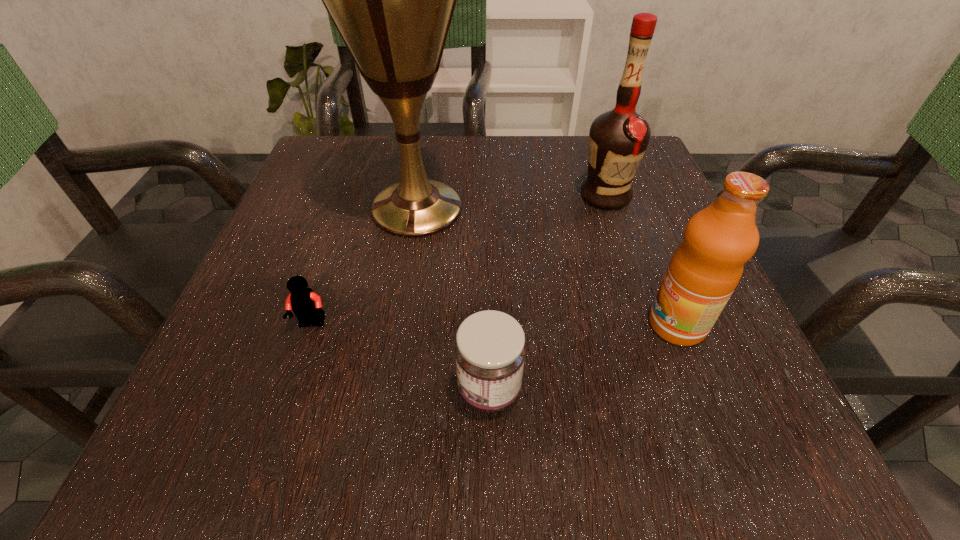
This screenshot has width=960, height=540. Find the location of `vacant space situated on the label side of the third tallest object`. vacant space situated on the label side of the third tallest object is located at coordinates (493, 325).

Where is `blank space located on the front label of the nearest object`? blank space located on the front label of the nearest object is located at coordinates (213, 390).

Image resolution: width=960 pixels, height=540 pixels. I want to click on free space located 0.150m on the front label of the nearest object, so click(x=343, y=390).

The image size is (960, 540). In order to click on vacant region located on the front label of the nearest object in this screenshot , I will do `click(389, 390)`.

This screenshot has width=960, height=540. What are the coordinates of `vacant space situated on the front-facing side of the shortest object` in the screenshot? It's located at (291, 389).

What are the coordinates of `trophy cup at the far edge` in the screenshot? It's located at (392, 0).

Identify the location of liquor that is at the far edge. (618, 139).

Where is `object that is at the near edge`? Image resolution: width=960 pixels, height=540 pixels. object that is at the near edge is located at coordinates (490, 350).

Where is `trophy cup at the left edge`? trophy cup at the left edge is located at coordinates (392, 0).

Identify the location of Lego present at the left edge. This screenshot has width=960, height=540. (306, 304).